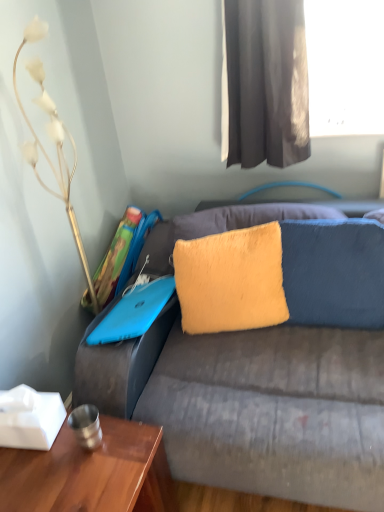
Question: Does wooden table at lower left have a greater height compared to metallic gold decorative at left?

Choices:
 (A) yes
 (B) no

Answer: (B)

Question: Is wooden table at lower left facing away from metallic gold decorative at left?

Choices:
 (A) yes
 (B) no

Answer: (B)

Question: Considering the relative sizes of wooden table at lower left and metallic gold decorative at left in the image provided, is wooden table at lower left bigger than metallic gold decorative at left?

Choices:
 (A) yes
 (B) no

Answer: (A)

Question: Does wooden table at lower left have a lesser width compared to metallic gold decorative at left?

Choices:
 (A) yes
 (B) no

Answer: (B)

Question: Is wooden table at lower left further to the viewer compared to metallic gold decorative at left?

Choices:
 (A) yes
 (B) no

Answer: (B)

Question: Is metallic gold decorative at left completely or partially inside wooden table at lower left?

Choices:
 (A) yes
 (B) no

Answer: (B)

Question: Is metallic gold decorative at left at the left side of wooden table at lower left?

Choices:
 (A) no
 (B) yes

Answer: (B)

Question: From the image's perspective, does metallic gold decorative at left appear lower than wooden table at lower left?

Choices:
 (A) no
 (B) yes

Answer: (A)

Question: From the image's perspective, is metallic gold decorative at left on top of wooden table at lower left?

Choices:
 (A) yes
 (B) no

Answer: (A)

Question: Can you confirm if metallic gold decorative at left is thinner than wooden table at lower left?

Choices:
 (A) no
 (B) yes

Answer: (B)

Question: Can wooden table at lower left be found inside metallic gold decorative at left?

Choices:
 (A) yes
 (B) no

Answer: (B)

Question: Considering the relative sizes of metallic gold decorative at left and wooden table at lower left in the image provided, is metallic gold decorative at left shorter than wooden table at lower left?

Choices:
 (A) yes
 (B) no

Answer: (B)

Question: From a real-world perspective, is dark gray fabric curtain at upper center physically above yellow fuzzy pillow at center, placed as the 2th pillow when sorted from left to right?

Choices:
 (A) yes
 (B) no

Answer: (A)